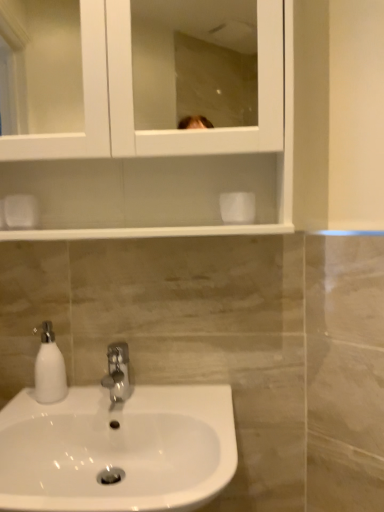
This screenshot has height=512, width=384. Find the location of `free location to the right of white glossy soap dispenser at lower left`. free location to the right of white glossy soap dispenser at lower left is located at coordinates (111, 400).